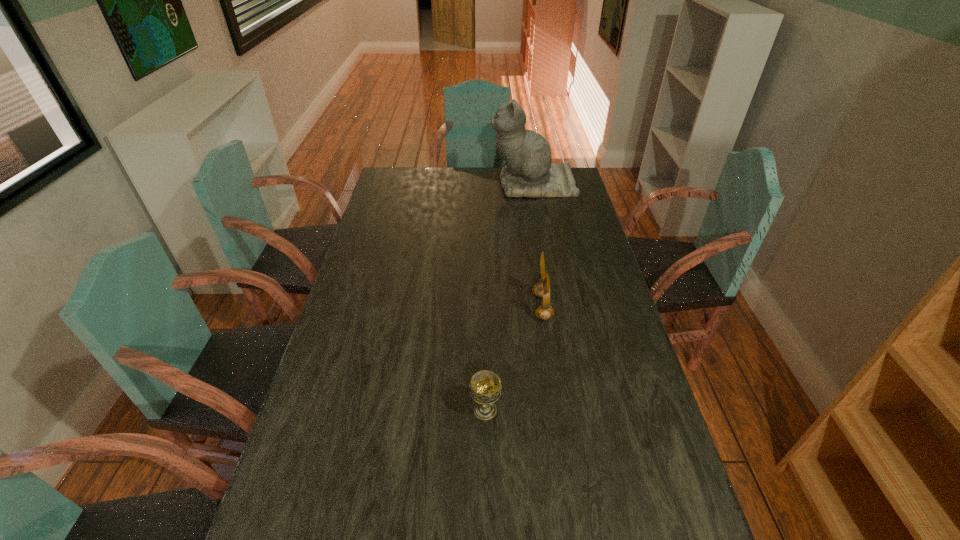
Where is `vacant space located 0.220m on the front-facing side of the earphone`? This screenshot has width=960, height=540. vacant space located 0.220m on the front-facing side of the earphone is located at coordinates (466, 307).

What are the coordinates of `vacant position located 0.190m on the front-facing side of the earphone` in the screenshot? It's located at (474, 307).

The image size is (960, 540). In order to click on free space located on the back of the shortest object in this screenshot , I will do `click(484, 321)`.

Identify the location of object present at the far edge. (528, 172).

Image resolution: width=960 pixels, height=540 pixels. I want to click on object located in the right edge section of the desktop, so click(528, 172).

The image size is (960, 540). Identify the location of object positioned at the far right corner. (528, 172).

The height and width of the screenshot is (540, 960). What are the coordinates of `vacant point at the far edge` in the screenshot? It's located at (439, 185).

At what (x,y) coordinates should I click in order to perform the action: click on free spot at the left edge of the desktop. Please return your answer as a coordinate pair (x, y). The height and width of the screenshot is (540, 960). Looking at the image, I should click on (374, 296).

Find the location of a particular element. free space at the right edge is located at coordinates (632, 450).

Find the location of `vacant region between the earphone and the shortest object`. vacant region between the earphone and the shortest object is located at coordinates (514, 359).